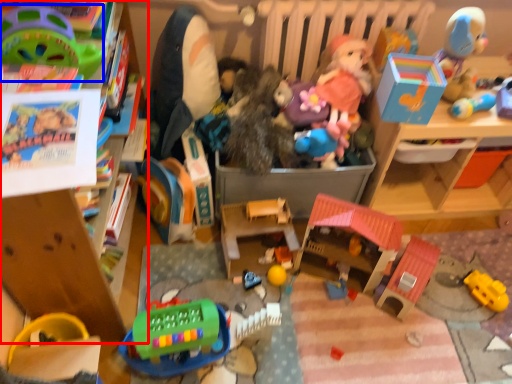
Question: Which point is closer to the camera, toy (highlighted by a red box) or toy (highlighted by a blue box)?

Choices:
 (A) toy
 (B) toy

Answer: (A)